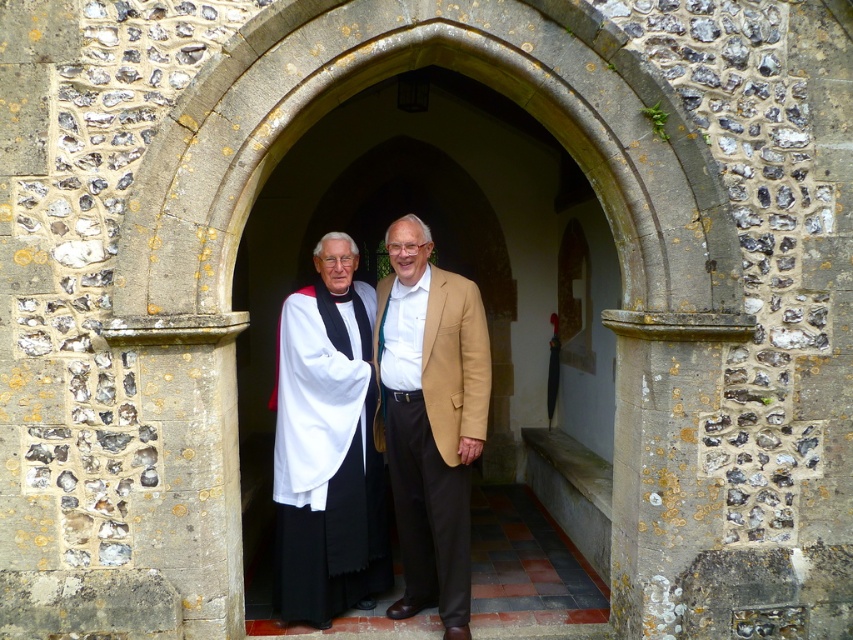
Question: Among these objects, which one is farthest from the camera?

Choices:
 (A) matte white robe at center
 (B) white matte/soft fabric robe at center
 (C) white cloth at center

Answer: (B)

Question: Which point is farther to the camera?

Choices:
 (A) matte white robe at center
 (B) white cloth at center
 (C) white matte/soft fabric robe at center

Answer: (C)

Question: Observing the image, what is the correct spatial positioning of white cloth at center in reference to white matte/soft fabric robe at center?

Choices:
 (A) above
 (B) below

Answer: (A)

Question: Is the position of white cloth at center less distant than that of white matte/soft fabric robe at center?

Choices:
 (A) no
 (B) yes

Answer: (B)

Question: Which object is positioned farthest from the matte white robe at center?

Choices:
 (A) white cloth at center
 (B) white matte/soft fabric robe at center

Answer: (B)

Question: Does white cloth at center have a lesser width compared to white matte/soft fabric robe at center?

Choices:
 (A) yes
 (B) no

Answer: (B)